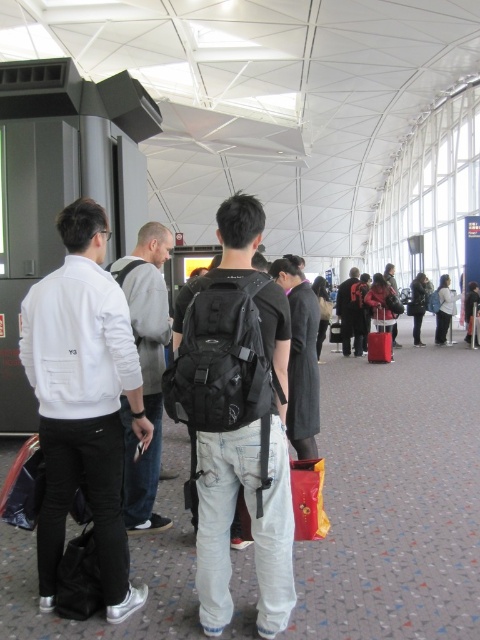
Question: Which object is farther from the camera taking this photo?

Choices:
 (A) gray fabric backpack at center
 (B) dark gray backpack at center
 (C) dark gray suit at center

Answer: (B)

Question: Which of the following is the farthest from the observer?

Choices:
 (A) dark gray suit at center
 (B) gray fabric backpack at center
 (C) dark gray backpack at center

Answer: (C)

Question: Does gray fabric backpack at center lie in front of dark gray suit at center?

Choices:
 (A) no
 (B) yes

Answer: (B)

Question: Is matte black backpack at center closer to the viewer compared to gray fabric backpack at center?

Choices:
 (A) no
 (B) yes

Answer: (B)

Question: Can you confirm if white matte jacket at left is smaller than dark gray backpack at center?

Choices:
 (A) no
 (B) yes

Answer: (B)

Question: Which point is closer to the camera?

Choices:
 (A) dark gray suit at center
 (B) white matte jacket at left

Answer: (B)